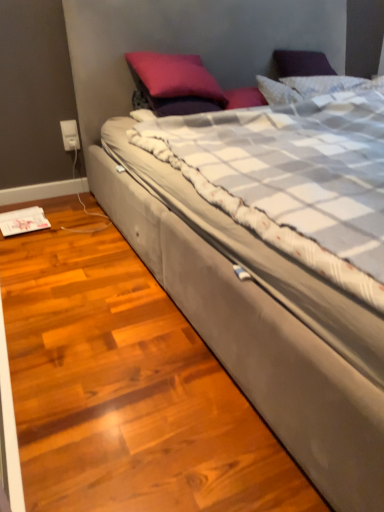
Question: Is suede bed at center positioned with its back to satin purple pillow at upper center?

Choices:
 (A) yes
 (B) no

Answer: (A)

Question: Can you confirm if suede bed at center is bigger than satin purple pillow at upper center?

Choices:
 (A) no
 (B) yes

Answer: (B)

Question: Considering the relative sizes of suede bed at center and satin purple pillow at upper center in the image provided, is suede bed at center shorter than satin purple pillow at upper center?

Choices:
 (A) no
 (B) yes

Answer: (A)

Question: Would you say suede bed at center contains satin purple pillow at upper center?

Choices:
 (A) no
 (B) yes

Answer: (B)

Question: From a real-world perspective, is suede bed at center positioned over satin purple pillow at upper center based on gravity?

Choices:
 (A) yes
 (B) no

Answer: (B)

Question: Is point (66, 134) positioned closer to the camera than point (175, 84)?

Choices:
 (A) closer
 (B) farther

Answer: (B)

Question: In terms of height, does white plastic electric outlet at lower left look taller or shorter compared to satin purple pillow at upper center?

Choices:
 (A) short
 (B) tall

Answer: (A)

Question: Based on their positions, is white plastic electric outlet at lower left located to the left or right of satin purple pillow at upper center?

Choices:
 (A) left
 (B) right

Answer: (A)

Question: In terms of size, does white plastic electric outlet at lower left appear bigger or smaller than satin purple pillow at upper center?

Choices:
 (A) big
 (B) small

Answer: (B)

Question: From the image's perspective, is satin purple pillow at upper center positioned above or below white plastic electric outlet at lower left?

Choices:
 (A) above
 (B) below

Answer: (A)

Question: In terms of height, does satin purple pillow at upper center look taller or shorter compared to white plastic electric outlet at lower left?

Choices:
 (A) tall
 (B) short

Answer: (A)

Question: Is point (x=173, y=72) closer or farther from the camera than point (x=72, y=128)?

Choices:
 (A) farther
 (B) closer

Answer: (B)

Question: From a real-world perspective, is satin purple pillow at upper center physically located above or below white plastic electric outlet at lower left?

Choices:
 (A) below
 (B) above

Answer: (B)

Question: From a real-world perspective, is suede bed at center physically located above or below white plastic electric outlet at lower left?

Choices:
 (A) above
 (B) below

Answer: (A)

Question: Based on their sizes in the image, would you say suede bed at center is bigger or smaller than white plastic electric outlet at lower left?

Choices:
 (A) big
 (B) small

Answer: (A)